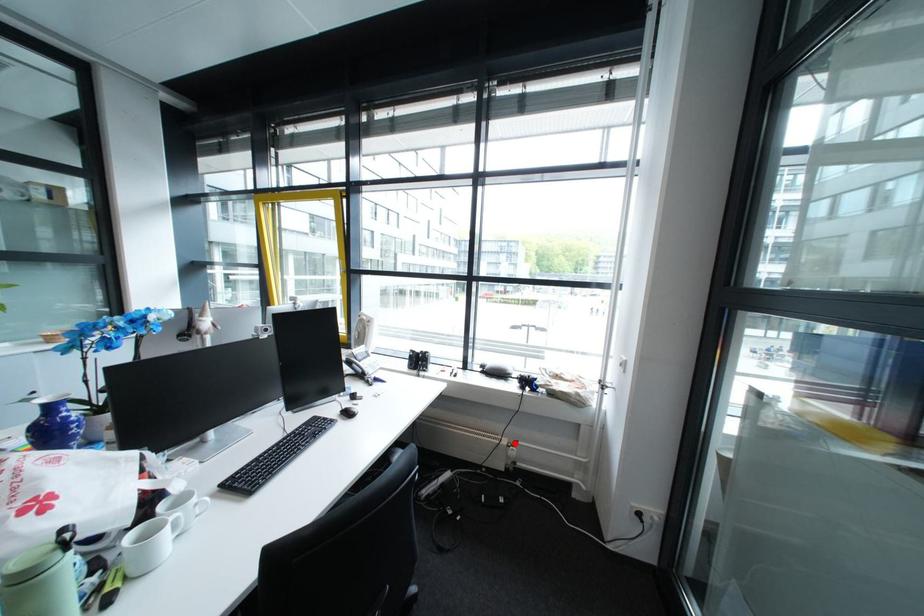
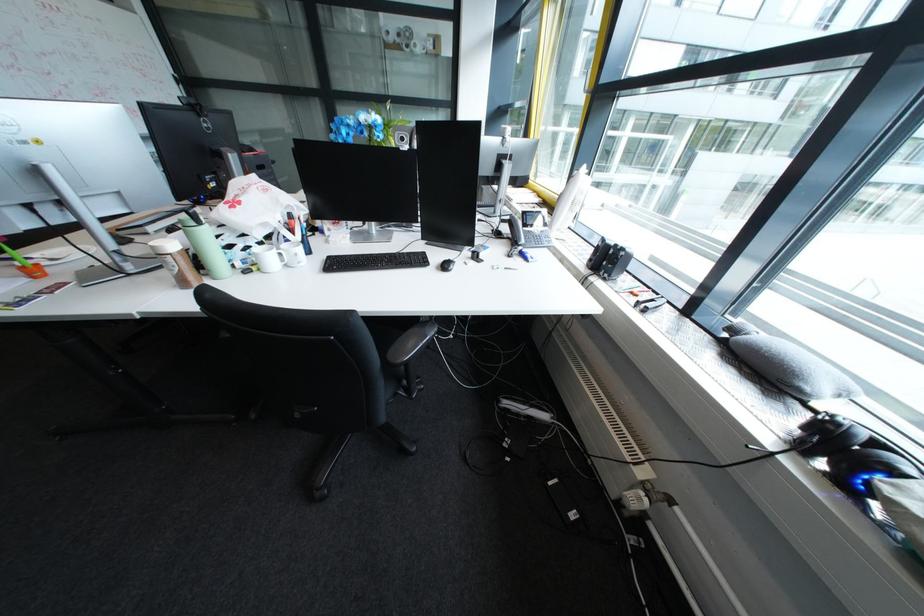
In the second image, find the point that corresponds to the highlighted location in the first image.

(646, 467)